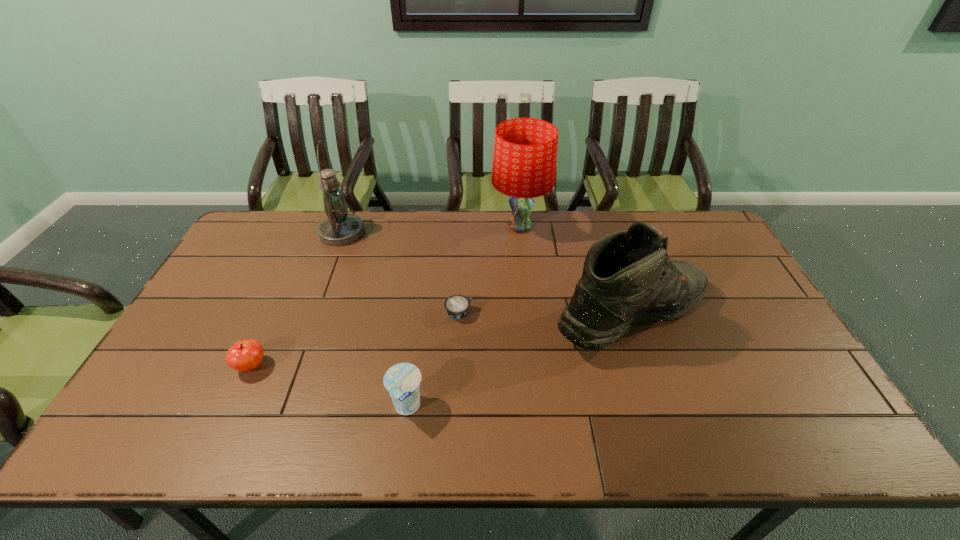
Locate an element on the screen. free space at the left edge of the desktop is located at coordinates (230, 321).

Find the location of a particular element. The image size is (960, 540). free region at the right edge is located at coordinates (786, 393).

This screenshot has width=960, height=540. Identify the location of free point at the far left corner. (291, 229).

Locate an element on the screen. vacant space at the far right corner is located at coordinates (703, 231).

Where is `vacant space that's between the lampshade and the apple`? This screenshot has height=540, width=960. vacant space that's between the lampshade and the apple is located at coordinates (386, 296).

You are a GUI agent. You are given a task and a screenshot of the screen. Output one action in this format:
    pyautogui.click(x=<x>, y=<y>)
    Task: Click on the vacant point located between the lampshade and the shortest object
    This screenshot has height=540, width=960.
    Given the screenshot: What is the action you would take?
    pyautogui.click(x=490, y=270)

The width and height of the screenshot is (960, 540). Find the location of `empty location between the apple and the oil lamp`. empty location between the apple and the oil lamp is located at coordinates [x=297, y=299].

Locate an element on the screen. This screenshot has width=960, height=540. free area in between the ski boot and the lampshade is located at coordinates (576, 272).

Locate an element on the screen. This screenshot has height=540, width=960. vacant area that lies between the lampshade and the shorter yogurt is located at coordinates (490, 270).

You are a GUI agent. You are given a task and a screenshot of the screen. Output one action in this format:
    pyautogui.click(x=<x>, y=<y>)
    Task: Click on the unoccupied position between the fourth tallest object and the second shortest object
    Image resolution: width=960 pixels, height=540 pixels.
    Given the screenshot: What is the action you would take?
    [329, 387]